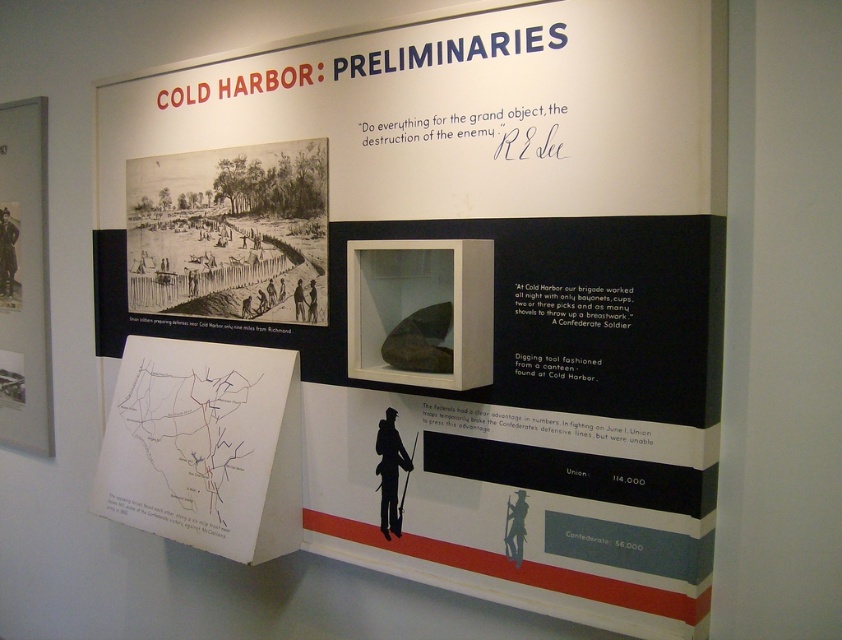
Question: Is white paper map at lower left further to camera compared to matte paper map at left?

Choices:
 (A) no
 (B) yes

Answer: (A)

Question: Is white paper map at lower left wider than matte paper map at left?

Choices:
 (A) no
 (B) yes

Answer: (B)

Question: Which point appears closest to the camera in this image?

Choices:
 (A) (281, 179)
 (B) (45, 246)

Answer: (A)

Question: Which point is farther from the camera taking this photo?

Choices:
 (A) (244, 193)
 (B) (29, 396)
 (C) (235, 490)

Answer: (B)

Question: Which point appears farthest from the camera in this image?

Choices:
 (A) (289, 189)
 (B) (27, 221)

Answer: (B)

Question: Does black paper at upper left have a greater width compared to matte paper map at left?

Choices:
 (A) yes
 (B) no

Answer: (A)